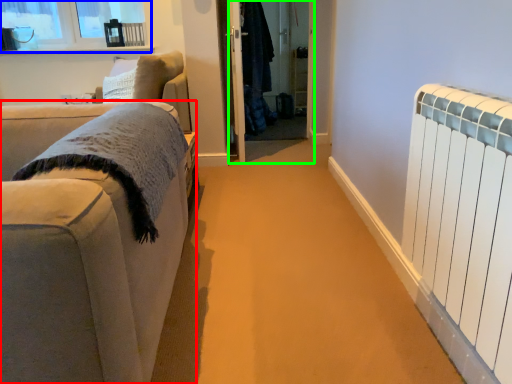
Question: Considering the real-world distances, which object is closest to studio couch (highlighted by a red box)? window (highlighted by a blue box) or screen door (highlighted by a green box).

Choices:
 (A) window
 (B) screen door

Answer: (B)